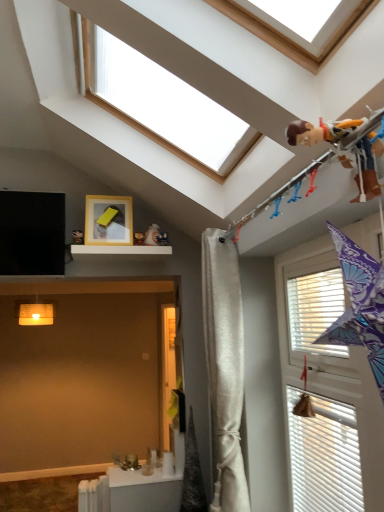
Question: Could you tell me if white textured window at right, arranged as the 1th window when viewed from the right, is facing white metallic radiator at lower left?

Choices:
 (A) yes
 (B) no

Answer: (B)

Question: From the image's perspective, is white textured window at right, the 2th window from the left, beneath white metallic radiator at lower left?

Choices:
 (A) yes
 (B) no

Answer: (B)

Question: From a real-world perspective, is white textured window at right, positioned as the 2th window in top-to-bottom order, located higher than white metallic radiator at lower left?

Choices:
 (A) yes
 (B) no

Answer: (A)

Question: Is white textured window at right, arranged as the 1th window when viewed from the right, at the right side of white metallic radiator at lower left?

Choices:
 (A) no
 (B) yes

Answer: (B)

Question: Is the depth of white textured window at right, arranged as the 1th window when viewed from the right, greater than that of white metallic radiator at lower left?

Choices:
 (A) yes
 (B) no

Answer: (B)

Question: From a real-world perspective, is white wood window at upper center, acting as the 1th window starting from the left, physically located above or below white textured window at right, positioned as the 2th window in top-to-bottom order?

Choices:
 (A) above
 (B) below

Answer: (A)

Question: From the image's perspective, is white wood window at upper center, acting as the 1th window starting from the left, above or below white textured window at right, positioned as the 2th window in top-to-bottom order?

Choices:
 (A) above
 (B) below

Answer: (A)

Question: In terms of width, does white wood window at upper center, the first window positioned from the top, look wider or thinner when compared to white textured window at right, positioned as the 2th window in top-to-bottom order?

Choices:
 (A) wide
 (B) thin

Answer: (A)

Question: Would you say white wood window at upper center, which is the 2th window from right to left, is inside or outside white textured window at right, positioned as the 2th window in top-to-bottom order?

Choices:
 (A) inside
 (B) outside

Answer: (B)

Question: Is white matte shelf at upper center taller or shorter than white wood window at upper center, acting as the 1th window starting from the left?

Choices:
 (A) short
 (B) tall

Answer: (A)

Question: Considering the positions of white matte shelf at upper center and white wood window at upper center, the 2th window ordered from the bottom, in the image, is white matte shelf at upper center wider or thinner than white wood window at upper center, the 2th window ordered from the bottom,?

Choices:
 (A) thin
 (B) wide

Answer: (A)

Question: From the image's perspective, is white matte shelf at upper center positioned above or below white wood window at upper center, which is the 2th window from right to left?

Choices:
 (A) below
 (B) above

Answer: (A)

Question: Do you think white matte shelf at upper center is within white wood window at upper center, the first window positioned from the top, or outside of it?

Choices:
 (A) outside
 (B) inside

Answer: (A)

Question: Is white wood window at upper center, the 2th window ordered from the bottom, in front of or behind white silky curtain at center in the image?

Choices:
 (A) front
 (B) behind

Answer: (A)

Question: From a real-world perspective, is white wood window at upper center, the first window positioned from the top, above or below white silky curtain at center?

Choices:
 (A) below
 (B) above

Answer: (B)